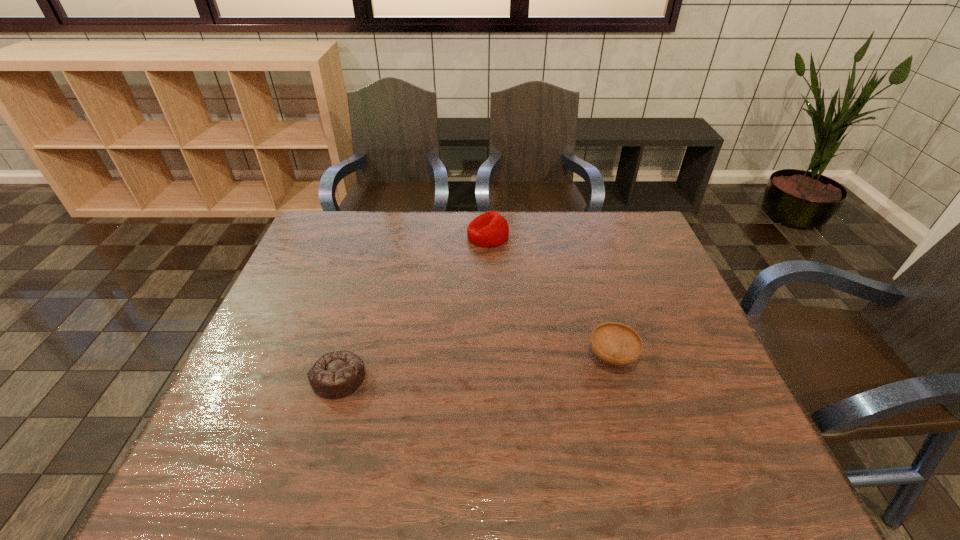
What are the coordinates of `free space that satisfies the following two spatial constraints: 1. on the back side of the rightmost object; 2. on the left side of the leftmost object` in the screenshot? It's located at (345, 357).

This screenshot has height=540, width=960. In order to click on free location that satisfies the following two spatial constraints: 1. on the seat area of the taller beanbag; 2. on the right side of the bowl in this screenshot , I will do coord(491,357).